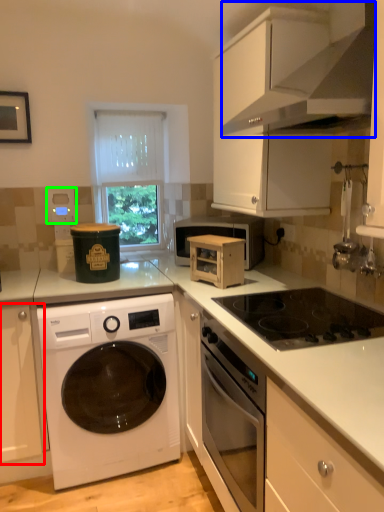
Question: Estimate the real-world distances between objects in this image. Which object is farther from cabinetry (highlighted by a red box), exhaust hood (highlighted by a blue box) or appliance (highlighted by a green box)?

Choices:
 (A) exhaust hood
 (B) appliance

Answer: (A)